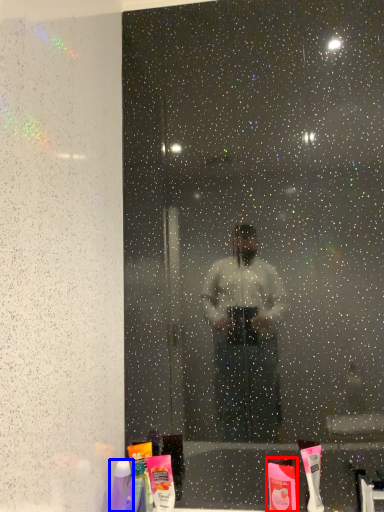
Question: Which object is closer to the camera taking this photo, toiletry (highlighted by a red box) or toiletry (highlighted by a blue box)?

Choices:
 (A) toiletry
 (B) toiletry

Answer: (B)